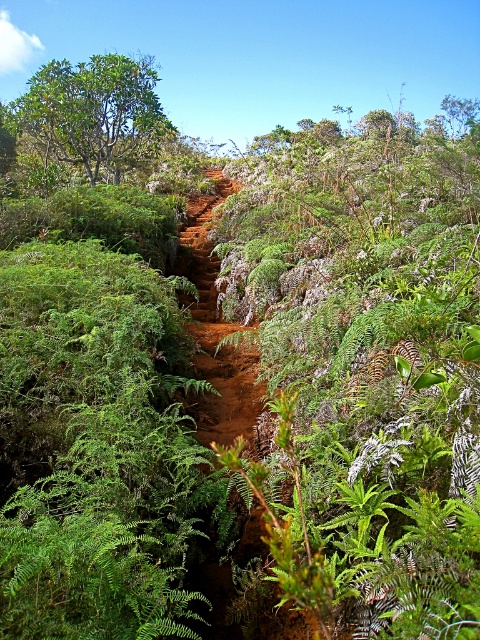
Question: Does brown earthy trail at center have a smaller size compared to green leafy tree at upper left?

Choices:
 (A) no
 (B) yes

Answer: (B)

Question: Does brown earthy trail at center have a greater width compared to green leafy tree at upper left?

Choices:
 (A) no
 (B) yes

Answer: (A)

Question: Which object appears farthest from the camera in this image?

Choices:
 (A) brown earthy trail at center
 (B) green leafy tree at upper left

Answer: (B)

Question: Can you confirm if brown earthy trail at center is positioned above green leafy tree at upper left?

Choices:
 (A) yes
 (B) no

Answer: (B)

Question: Which point is closer to the camera taking this photo?

Choices:
 (A) (28, 113)
 (B) (215, 573)

Answer: (B)

Question: Which point appears closest to the camera in this image?

Choices:
 (A) (156, 122)
 (B) (233, 400)

Answer: (B)